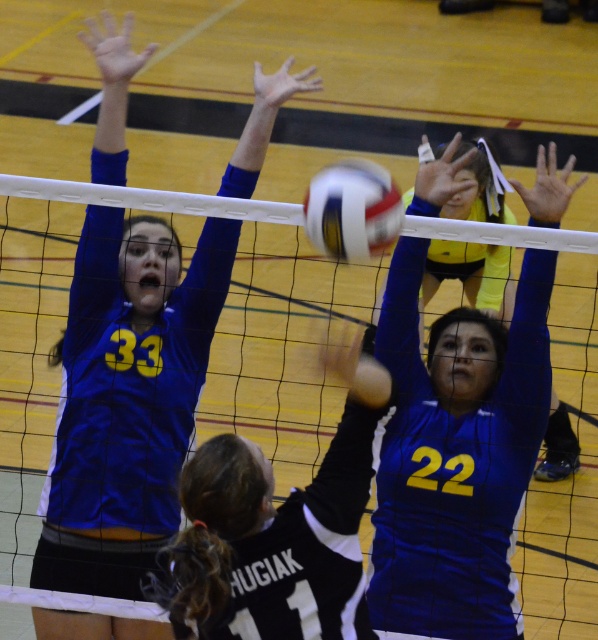
You are a volleyball coach observing the game. You notice the white mesh net at center and the blue jersey at center. Which object is taller in the image?

The blue jersey at center is taller than the white mesh net at center.

You are a referee observing the volleyball game. You notice the matte blue jersey at upper left and the white matte volleyball at center. Which object is positioned to the left of the other?

The matte blue jersey at upper left is positioned to the left of the white matte volleyball at center.